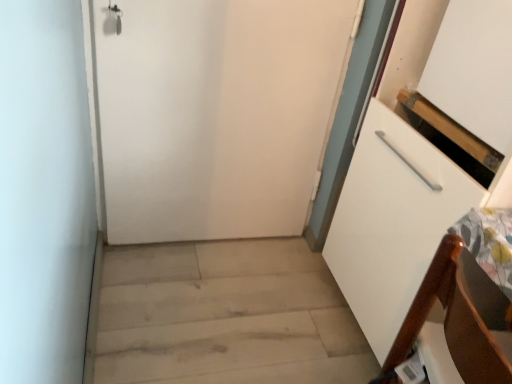
Question: From the image's perspective, is light wood floor at lower left above or below white matte door at center?

Choices:
 (A) below
 (B) above

Answer: (A)

Question: Is light wood floor at lower left inside the boundaries of white matte door at center, or outside?

Choices:
 (A) inside
 (B) outside

Answer: (B)

Question: Considering the real-world distances, which object is closest to the white matte door at center?

Choices:
 (A) light wood floor at lower left
 (B) brown wood chair at lower right

Answer: (A)

Question: Considering the real-world distances, which object is farthest from the light wood floor at lower left?

Choices:
 (A) brown wood chair at lower right
 (B) white matte door at center

Answer: (A)